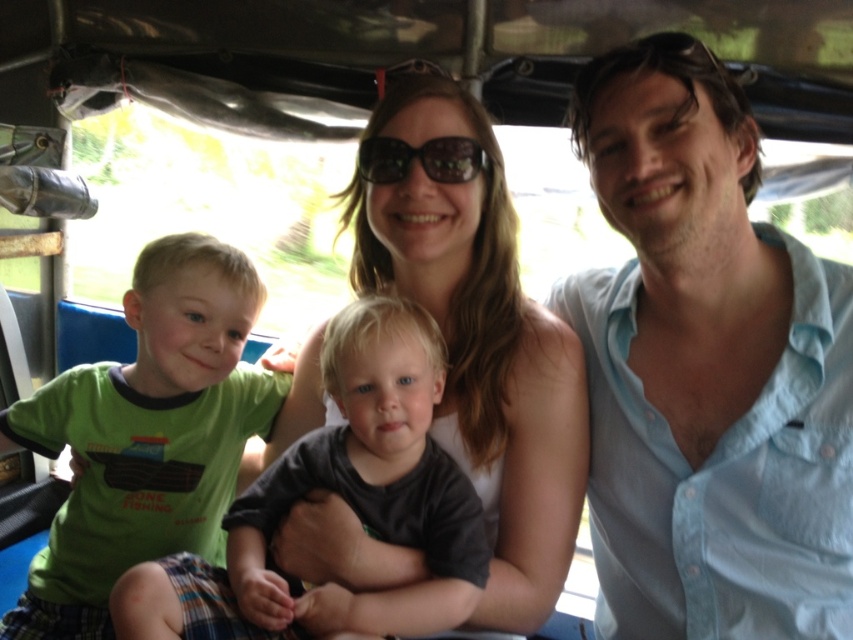
Question: Which object is positioned closest to the dark reflective sunglasses at center?

Choices:
 (A) green cotton shirt at left
 (B) green cotton shirt at center
 (C) matte white shirt at center
 (D) light blue button-down shirt at right

Answer: (C)

Question: Is light blue button-down shirt at right positioned at the back of green cotton shirt at left?

Choices:
 (A) yes
 (B) no

Answer: (B)

Question: Among these points, which one is farthest from the camera?

Choices:
 (A) (488, 515)
 (B) (440, 150)
 (C) (807, 301)
 (D) (164, 362)

Answer: (D)

Question: Does light blue button-down shirt at right appear under green cotton shirt at left?

Choices:
 (A) yes
 (B) no

Answer: (B)

Question: Which object is positioned farthest from the green cotton shirt at center?

Choices:
 (A) light blue button-down shirt at right
 (B) green cotton shirt at left
 (C) matte white shirt at center

Answer: (B)

Question: Observing the image, what is the correct spatial positioning of light blue button-down shirt at right in reference to matte white shirt at center?

Choices:
 (A) below
 (B) above

Answer: (A)